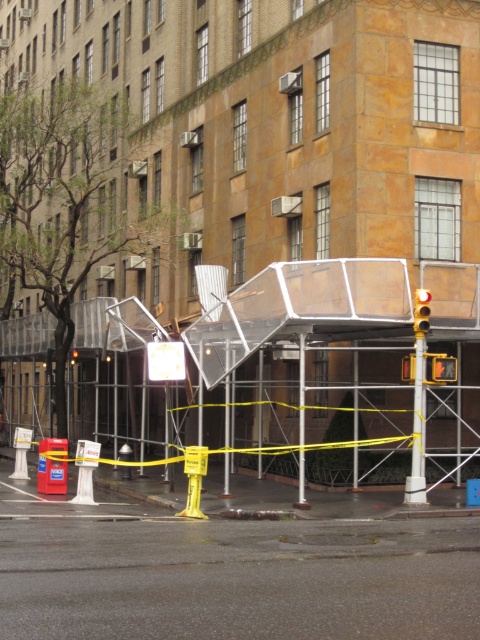
Question: Is metallic yellow pole at right smaller than yellow plastic traffic light at center?

Choices:
 (A) no
 (B) yes

Answer: (A)

Question: Is metallic yellow pole at right behind yellow plastic traffic light at center?

Choices:
 (A) no
 (B) yes

Answer: (B)

Question: Among these objects, which one is farthest from the camera?

Choices:
 (A) yellow plastic traffic light at center
 (B) metallic yellow pole at right

Answer: (B)

Question: Where is metallic yellow pole at right located in relation to yellow plastic traffic light at center in the image?

Choices:
 (A) left
 (B) right

Answer: (A)

Question: Which object is farther from the camera taking this photo?

Choices:
 (A) metallic yellow pole at right
 (B) yellow plastic traffic light at center

Answer: (A)